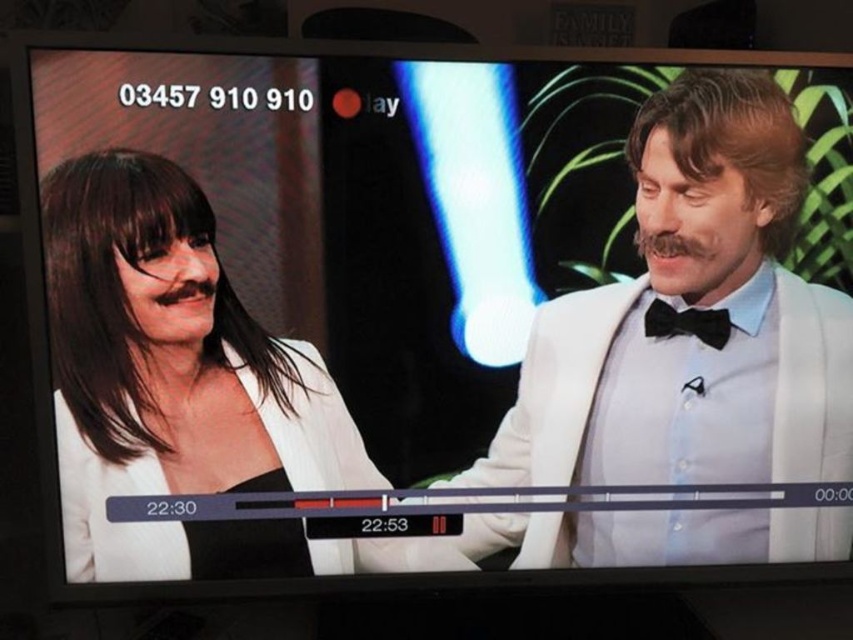
Does white satin suit at right have a greater width compared to black satin bow tie at right?

Yes, white satin suit at right is wider than black satin bow tie at right.

Is white satin suit at right further to the viewer compared to black satin bow tie at right?

That is False.

Does point (814, 467) lie behind point (718, 312)?

That is True.

Locate an element on the screen. The height and width of the screenshot is (640, 853). white satin suit at right is located at coordinates (695, 307).

Who is more forward, (x=521, y=483) or (x=67, y=509)?

Positioned in front is point (x=67, y=509).

Does point (778, 186) lie behind point (202, 202)?

Yes.

At what (x,y) coordinates should I click in order to perform the action: click on white satin suit at right. Please return your answer as a coordinate pair (x, y). This screenshot has width=853, height=640. Looking at the image, I should click on (695, 307).

Can you confirm if matte white blazer at left is thinner than black satin bow tie at right?

Incorrect, matte white blazer at left's width is not less than black satin bow tie at right's.

Does matte white blazer at left lie in front of black satin bow tie at right?

Yes.

Does point (76, 307) come closer to viewer compared to point (708, 344)?

Yes, it is in front of point (708, 344).

At what (x,y) coordinates should I click in order to perform the action: click on matte white blazer at left. Please return your answer as a coordinate pair (x, y). This screenshot has width=853, height=640. Looking at the image, I should click on (178, 385).